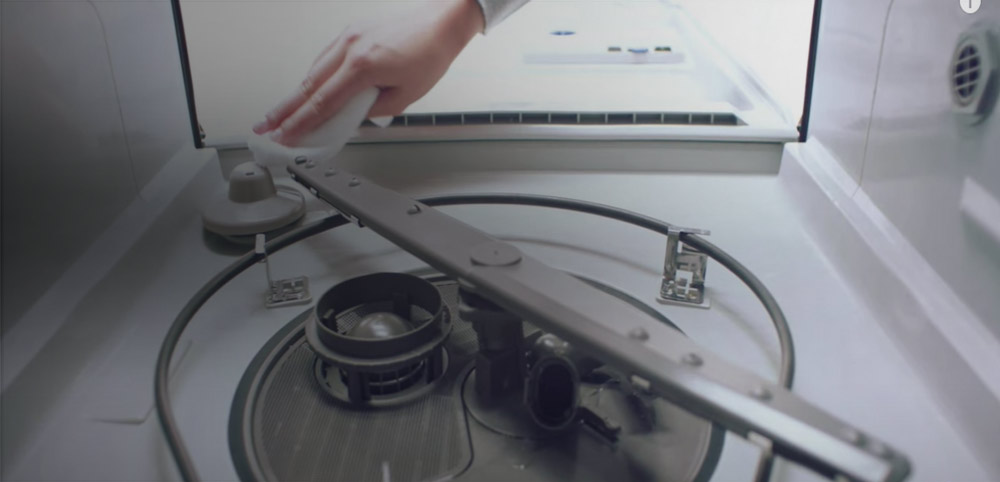
The height and width of the screenshot is (482, 1000). What are the coordinates of `right side of dishwasher panel` in the screenshot? It's located at (934, 149).